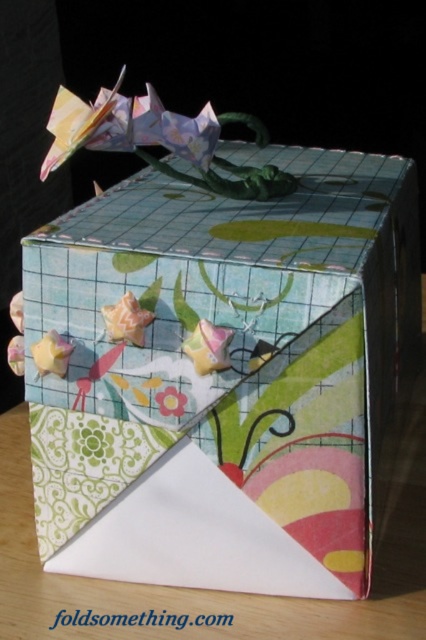
Which is more to the left, decorative paper box at center or pastel floral paper flower at center?

pastel floral paper flower at center is more to the left.

In the scene shown: Measure the distance from decorative paper box at center to pastel floral paper flower at center.

9.80 inches

Is point (236, 236) behind point (169, 406)?

Yes, it is behind point (169, 406).

You are a GUI agent. You are given a task and a screenshot of the screen. Output one action in this format:
    pyautogui.click(x=<x>, y=<y>)
    Task: Click on the decorative paper box at center
    
    Given the screenshot: What is the action you would take?
    pyautogui.click(x=224, y=372)